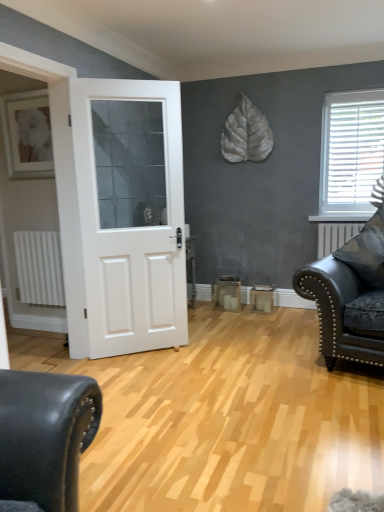
Question: Is matte black leather couch at right spatially inside white matte radiator at left, or outside of it?

Choices:
 (A) inside
 (B) outside

Answer: (B)

Question: Considering the relative positions of matte black leather couch at right and white matte radiator at left in the image provided, is matte black leather couch at right to the left or to the right of white matte radiator at left?

Choices:
 (A) left
 (B) right

Answer: (B)

Question: Which object is positioned farthest from the white matte door at center?

Choices:
 (A) white matte radiator at left
 (B) white plastic blinds at upper right
 (C) matte black leather couch at right
 (D) matte white picture frame at upper left

Answer: (B)

Question: Based on their relative distances, which object is farther from the matte black leather couch at right?

Choices:
 (A) white matte door at center
 (B) matte white picture frame at upper left
 (C) white plastic blinds at upper right
 (D) white matte radiator at left

Answer: (B)